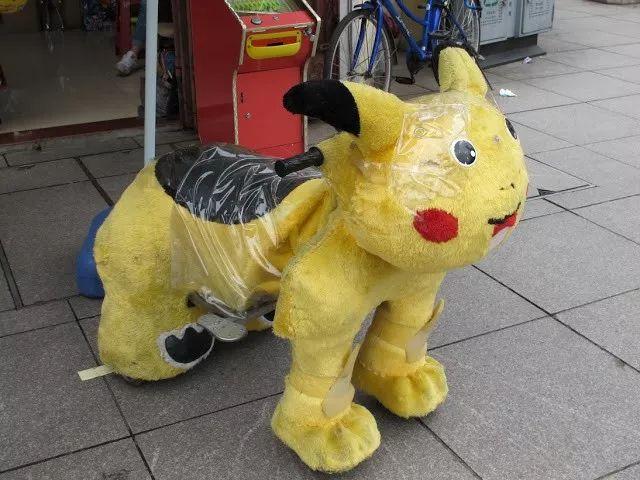
Locate an element on the screen. Image resolution: width=640 pixels, height=480 pixels. white board with text is located at coordinates (508, 28).